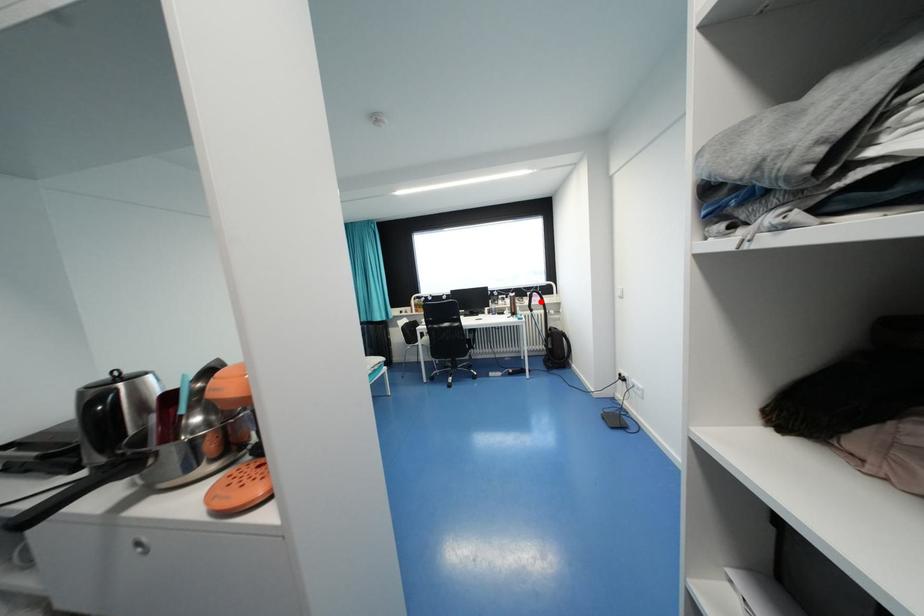
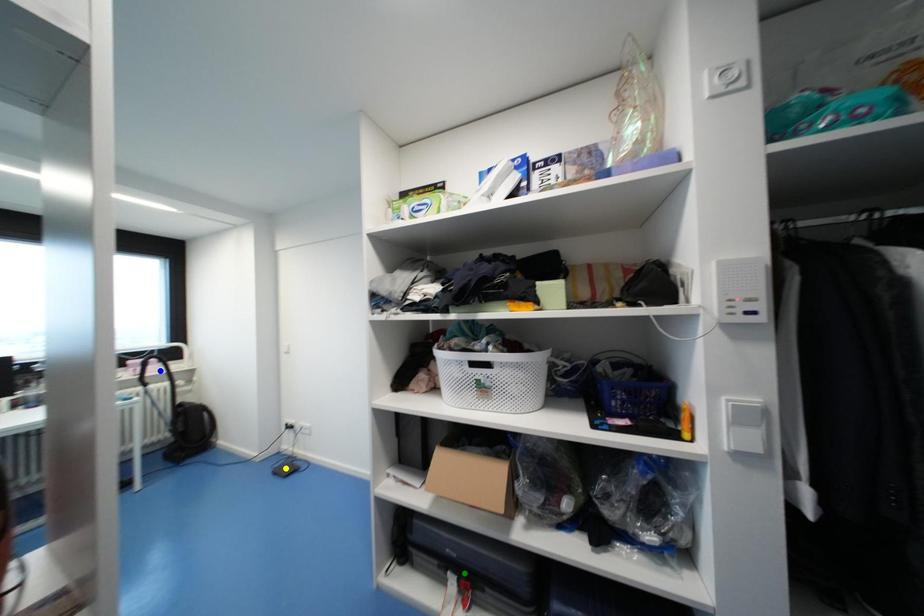
Question: I am providing you with two images of the same scene from different viewpoints. A red point is marked on the first image. You are given multiple points on the second image. In image 2, which mark is for the same physical point as the one in image 1?

Choices:
 (A) green point
 (B) blue point
 (C) yellow point

Answer: (B)